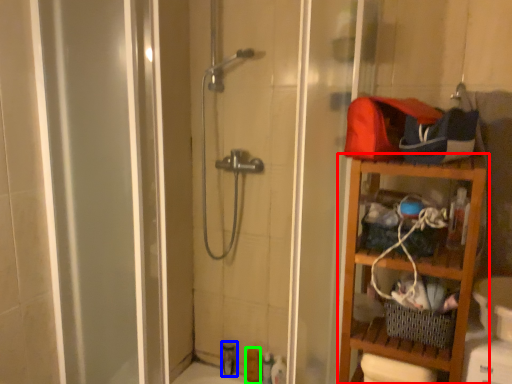
Question: Which object is the closest to the shelf (highlighted by a red box)? Choose among these: toiletry (highlighted by a blue box) or toiletry (highlighted by a green box).

Choices:
 (A) toiletry
 (B) toiletry

Answer: (B)